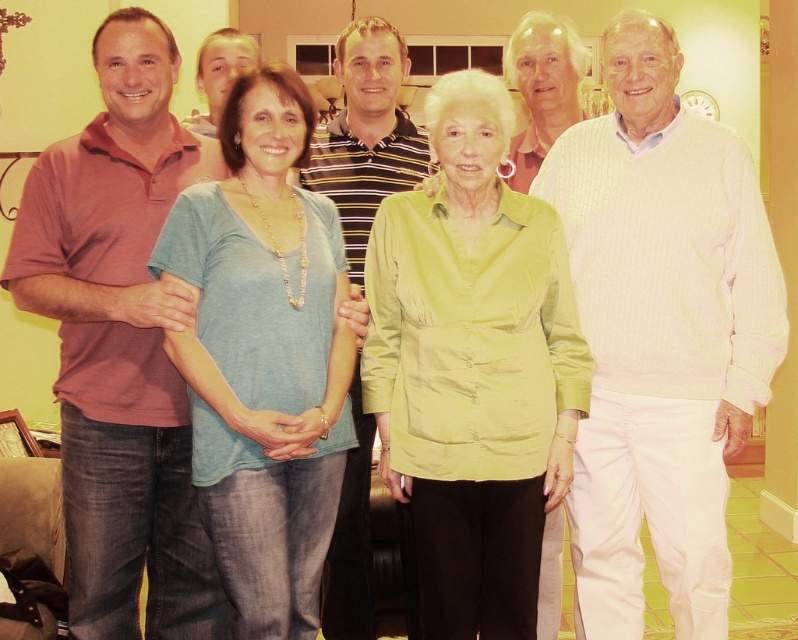
Is the position of white ribbed sweater at right less distant than that of white textured sweater at upper center?

Yes, white ribbed sweater at right is in front of white textured sweater at upper center.

Is white ribbed sweater at right to the right of white textured sweater at upper center from the viewer's perspective?

Yes, white ribbed sweater at right is to the right of white textured sweater at upper center.

Find the location of a particular element. This screenshot has width=798, height=640. white ribbed sweater at right is located at coordinates (662, 333).

Which of these two, matte green blouse at center or striped polo shirt at center, stands shorter?

With less height is striped polo shirt at center.

What are the coordinates of `matte green blouse at center` in the screenshot? It's located at (473, 369).

In the scene shown: Which is more to the left, matte red polo shirt at left or striped polo shirt at center?

matte red polo shirt at left is more to the left.

You are a GUI agent. You are given a task and a screenshot of the screen. Output one action in this format:
    pyautogui.click(x=<x>, y=<y>)
    Task: Click on the matte red polo shirt at left
    
    Given the screenshot: What is the action you would take?
    pyautogui.click(x=120, y=342)

Locate an element on the screen. matte red polo shirt at left is located at coordinates (120, 342).